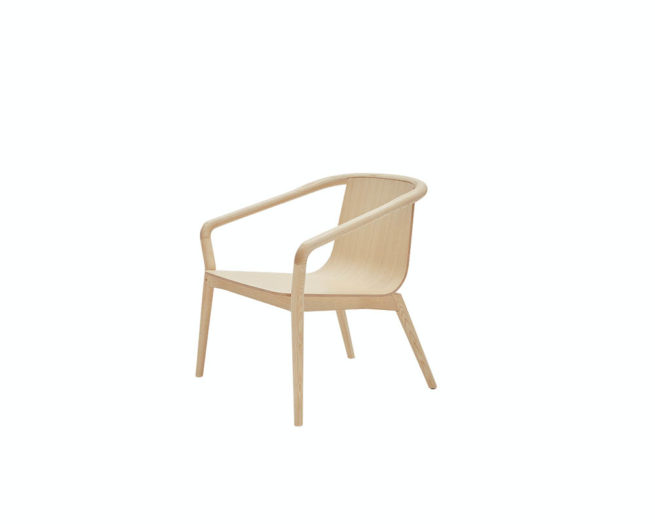
Locate an element on the screen. empty space above chair is located at coordinates (318, 127).